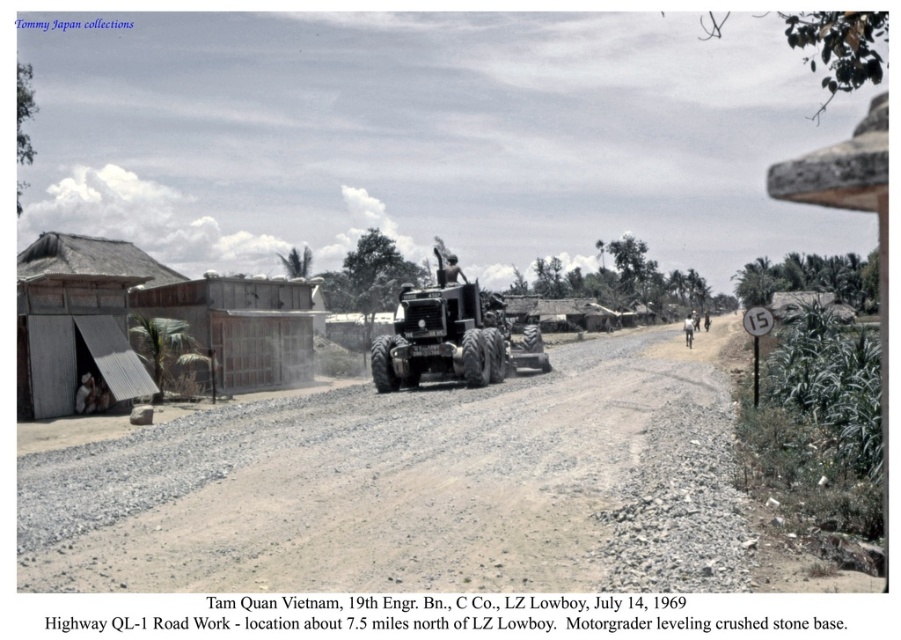
Question: Does gravelly dirt track at center appear under metal corrugated hut at left?

Choices:
 (A) no
 (B) yes

Answer: (B)

Question: Which point appears farthest from the camera in this image?

Choices:
 (A) (394, 433)
 (B) (432, 324)
 (C) (253, 301)

Answer: (C)

Question: Considering the real-world distances, which object is farthest from the gravelly dirt track at center?

Choices:
 (A) metal corrugated hut at left
 (B) brown corrugated metal hut at center-left

Answer: (A)

Question: Does gravelly dirt track at center come behind brushed metal tractor at center?

Choices:
 (A) yes
 (B) no

Answer: (B)

Question: Among these points, which one is farthest from the camera?

Choices:
 (A) (107, 362)
 (B) (248, 554)
 (C) (260, 276)

Answer: (C)

Question: Can you confirm if metal corrugated hut at left is positioned below brown corrugated metal hut at center-left?

Choices:
 (A) no
 (B) yes

Answer: (A)